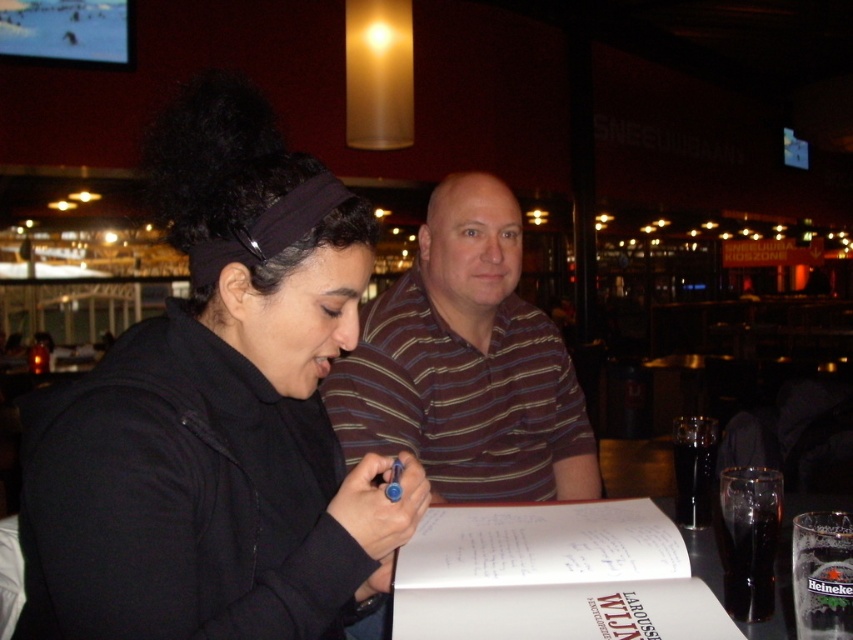
You are a photographer standing 3 feet away from the table. You want to take a picture of both the black matte jacket at center and the striped cotton shirt at center. Can you fit both subjects in the frame without moving the camera? Please explain your reasoning.

The black matte jacket at center and striped cotton shirt at center are 22.05 inches apart. Since the photographer is 3 feet away, which is 36 inches, the distance between the subjects is less than the camera frame width at that distance. Therefore, both can be captured in a single frame without moving the camera.

You are a photographer trying to capture a closeup of the black matte jacket at center. You are currently positioned at the point with coordinates point [213,461]. Can you get a clear shot of the black matte jacket at center from this position?

Yes, because the point [213,461] is on the black matte jacket at center, so you can get a clear shot from this position.